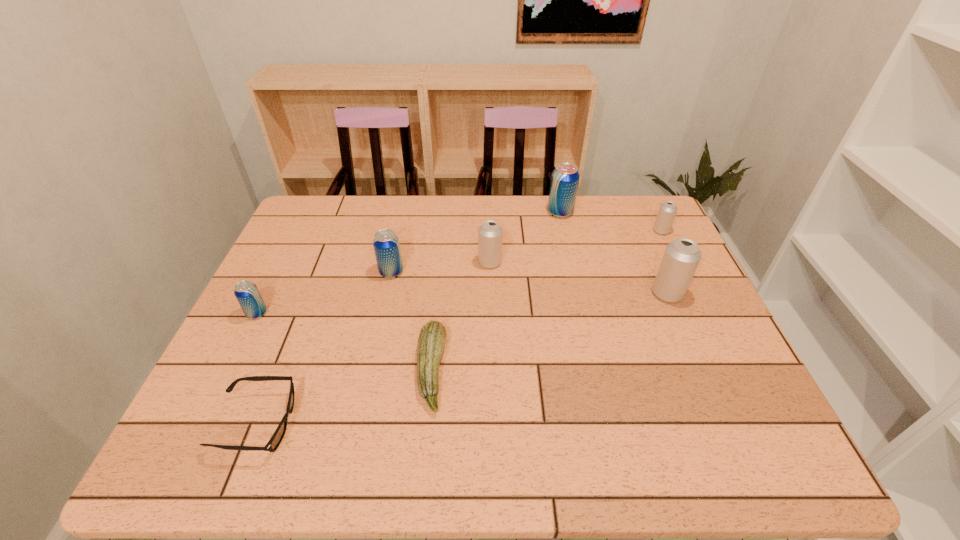
Select which white beer can is the closest to the leftmost blue beer can. Please provide its 2D coordinates. Your answer should be formatted as a tuple, i.e. [(x, y)], where the tuple contains the x and y coordinates of a point satisfying the conditions above.

[(490, 233)]